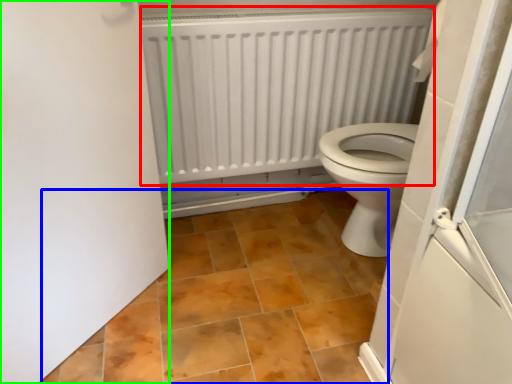
Question: Which is farther away from radiator (highlighted by a red box)? ceramic tile (highlighted by a blue box) or door (highlighted by a green box)?

Choices:
 (A) ceramic tile
 (B) door

Answer: (B)